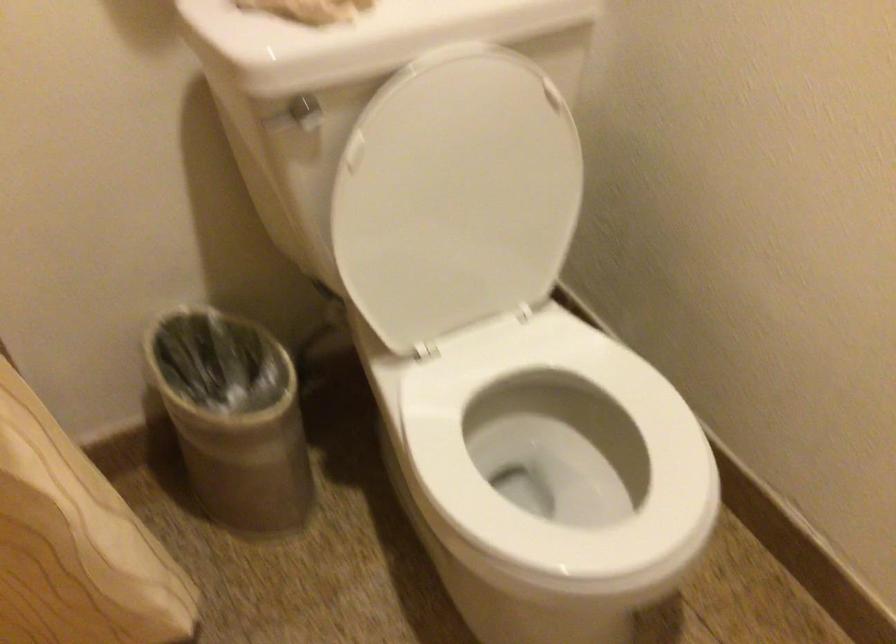
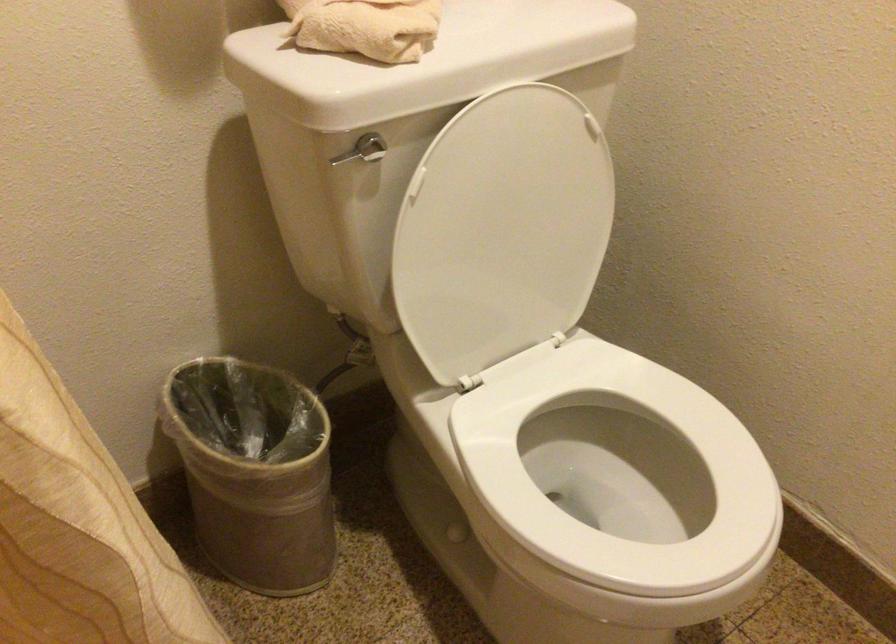
Locate, in the second image, the point that corresponds to (x=454, y=202) in the first image.

(502, 230)